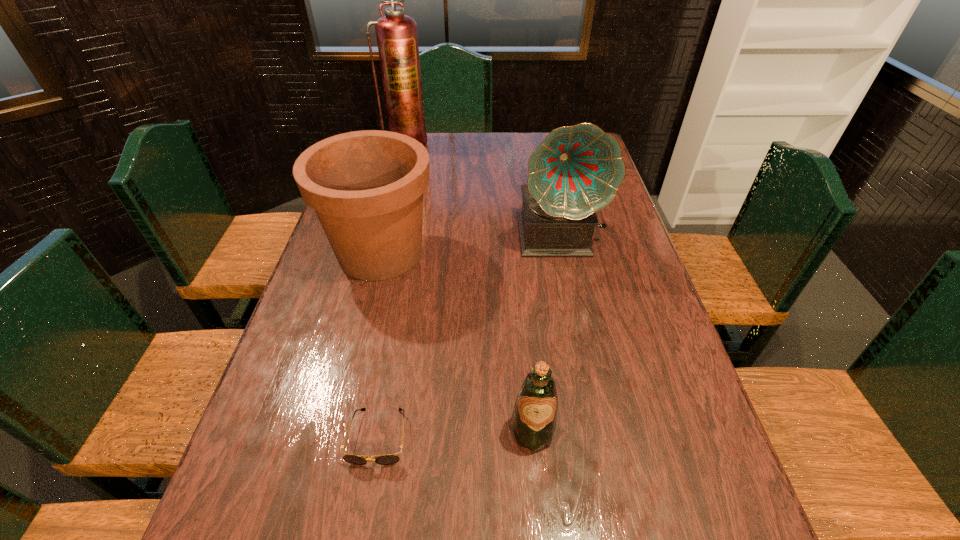
Find the location of a particular element. The image size is (960, 540). vacant point located between the second tallest object and the fire extinguisher is located at coordinates (483, 190).

The width and height of the screenshot is (960, 540). Identify the location of vacant point located between the tallest object and the second tallest object. (483, 190).

You are a GUI agent. You are given a task and a screenshot of the screen. Output one action in this format:
    pyautogui.click(x=<x>, y=<y>)
    Task: Click on the vacant space that is in between the shortest object and the flowerpot
    
    Given the screenshot: What is the action you would take?
    pyautogui.click(x=379, y=345)

This screenshot has width=960, height=540. Find the location of `empty location between the second shortest object and the fire extinguisher`. empty location between the second shortest object and the fire extinguisher is located at coordinates click(x=469, y=287).

What are the coordinates of `free spot between the third tallest object and the sunglasses` in the screenshot? It's located at (379, 345).

Where is `vacant point located between the second tallest object and the farthest object`? vacant point located between the second tallest object and the farthest object is located at coordinates (483, 190).

This screenshot has width=960, height=540. In order to click on free area in between the olive oil and the third shortest object in this screenshot , I will do `click(456, 342)`.

Where is `vacant space that is in between the record player and the olive oil`? vacant space that is in between the record player and the olive oil is located at coordinates (545, 334).

Where is `the second closest object to the third tallest object`? The image size is (960, 540). the second closest object to the third tallest object is located at coordinates (388, 459).

Identify which object is the fourth nearest to the fourth tallest object. Please provide its 2D coordinates. Your answer should be formatted as a tuple, i.e. [(x, y)], where the tuple contains the x and y coordinates of a point satisfying the conditions above.

[(397, 39)]